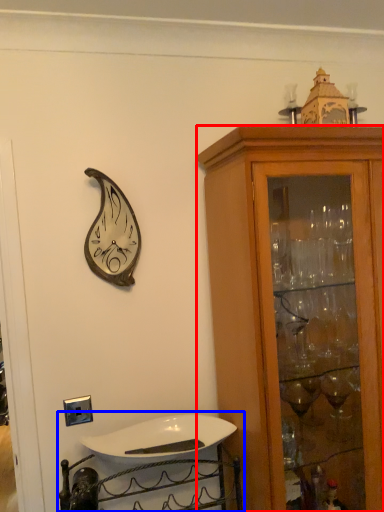
Question: Which point is further to the camera, cabinetry (highlighted by a red box) or sink (highlighted by a blue box)?

Choices:
 (A) cabinetry
 (B) sink

Answer: (B)